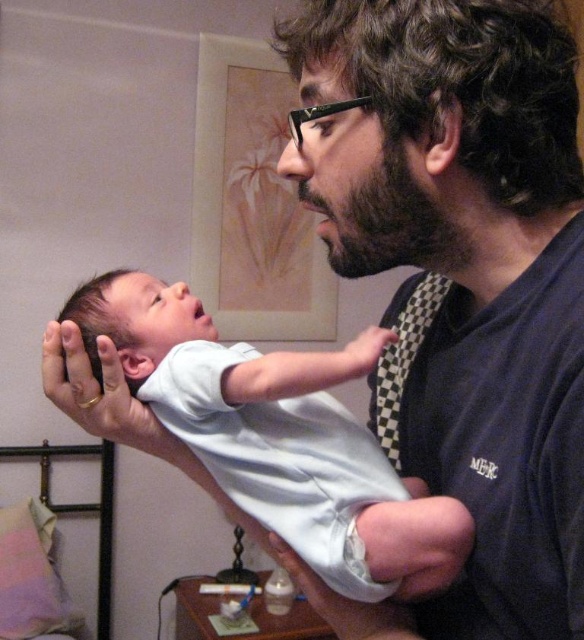
Who is more forward, (x=258, y=296) or (x=401, y=180)?

Positioned in front is point (x=401, y=180).

Consider the image. Who is taller, matte paper picture frame at upper center or dark brown thick beard at center?

matte paper picture frame at upper center is taller.

Identify the location of matte paper picture frame at upper center. The width and height of the screenshot is (584, 640). (252, 204).

Measure the distance from dark blue shirt at center to dark brown thick beard at center.

dark blue shirt at center and dark brown thick beard at center are 3.77 inches apart from each other.

What do you see at coordinates (464, 273) in the screenshot? I see `dark blue shirt at center` at bounding box center [464, 273].

Between point (464, 224) and point (422, 196), which one is positioned behind?

Positioned behind is point (464, 224).

Image resolution: width=584 pixels, height=640 pixels. In order to click on dark blue shirt at center in this screenshot , I will do `click(464, 273)`.

Is white cotton onesie at center positioned before dark brown thick beard at center?

No, it is not.

The width and height of the screenshot is (584, 640). Describe the element at coordinates (279, 436) in the screenshot. I see `white cotton onesie at center` at that location.

I want to click on white cotton onesie at center, so click(279, 436).